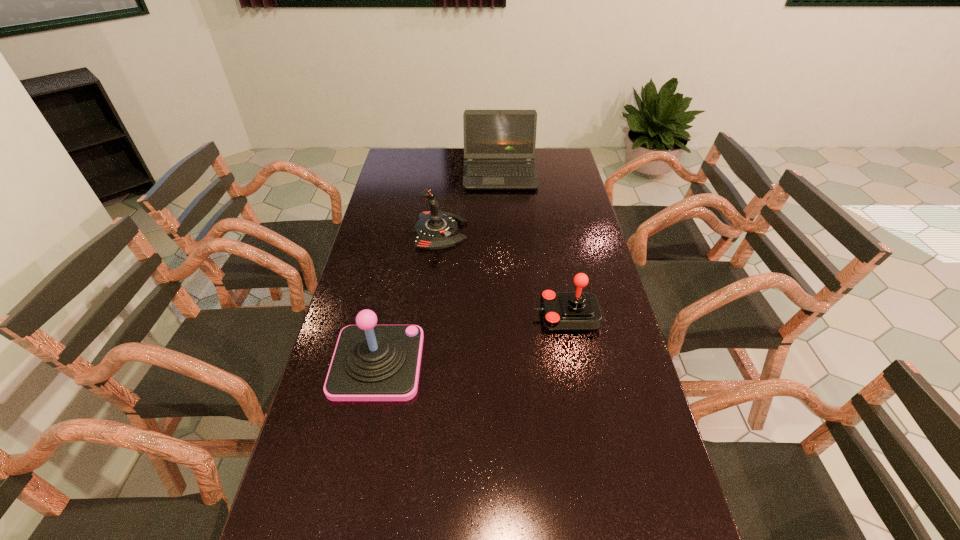
The height and width of the screenshot is (540, 960). I want to click on object located in the right edge section of the desktop, so click(578, 311).

In the image, there is a desktop. Find the location of `vacant space at the far edge`. vacant space at the far edge is located at coordinates (x=460, y=161).

I want to click on blank space at the left edge, so click(375, 220).

Locate an element on the screen. This screenshot has height=540, width=960. vacant space at the right edge of the desktop is located at coordinates (566, 209).

In the image, there is a desktop. Where is `vacant space at the far left corner`? vacant space at the far left corner is located at coordinates (401, 151).

The width and height of the screenshot is (960, 540). What are the coordinates of `free space at the far right corner of the desktop` in the screenshot? It's located at (557, 158).

Locate an element on the screen. This screenshot has width=960, height=540. vacant point located between the rightmost joystick and the laptop_computer is located at coordinates (533, 245).

Where is `blank region between the farthest joystick and the farthest object`? This screenshot has height=540, width=960. blank region between the farthest joystick and the farthest object is located at coordinates (470, 203).

Where is `free space between the farthest object and the farthest joystick`? This screenshot has width=960, height=540. free space between the farthest object and the farthest joystick is located at coordinates point(470,203).

The height and width of the screenshot is (540, 960). What are the coordinates of `free space between the farthest object and the rightmost joystick` in the screenshot? It's located at (533, 245).